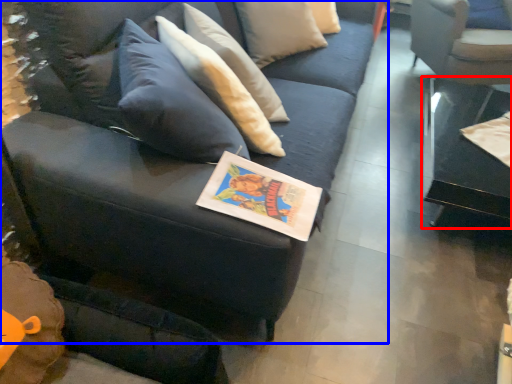
Question: Which of the following is the farthest to the observer, table (highlighted by a red box) or studio couch (highlighted by a blue box)?

Choices:
 (A) table
 (B) studio couch

Answer: (A)